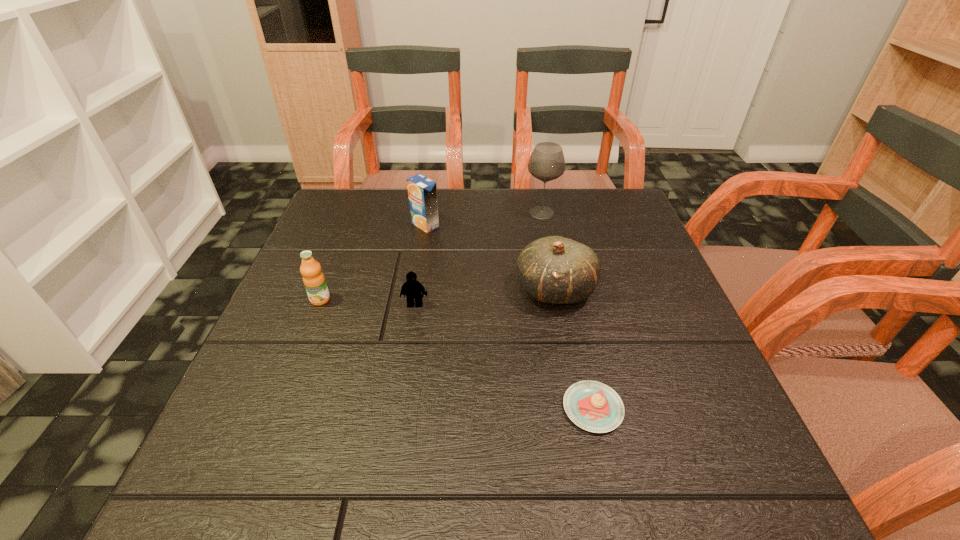
Locate an element on the screen. The width and height of the screenshot is (960, 540). blank space located 0.160m on the front of the gourd is located at coordinates (572, 381).

Locate an element on the screen. The image size is (960, 540). blank area located 0.310m on the label of the nearer orange juice is located at coordinates 264,442.

Where is `free point located on the face of the Lego`? Image resolution: width=960 pixels, height=540 pixels. free point located on the face of the Lego is located at coordinates (403, 378).

The width and height of the screenshot is (960, 540). I want to click on free spot located 0.270m on the left of the pastry, so click(406, 408).

You are a GUI agent. You are given a task and a screenshot of the screen. Output one action in this format:
    pyautogui.click(x=<x>, y=<y>)
    Task: Click on the wineglass located at the far edge
    
    Given the screenshot: What is the action you would take?
    pyautogui.click(x=546, y=163)

Image resolution: width=960 pixels, height=540 pixels. I want to click on orange_juice that is at the far edge, so click(422, 191).

Find the location of a particular element. Image resolution: width=960 pixels, height=540 pixels. object at the left edge is located at coordinates (314, 281).

Image resolution: width=960 pixels, height=540 pixels. Find the location of `vacant region at the far edge of the desktop`. vacant region at the far edge of the desktop is located at coordinates (526, 190).

Find the location of a particular element. The height and width of the screenshot is (540, 960). vacant area at the near edge of the desktop is located at coordinates (353, 508).

Locate an element on the screen. The width and height of the screenshot is (960, 540). free space at the left edge is located at coordinates (363, 253).